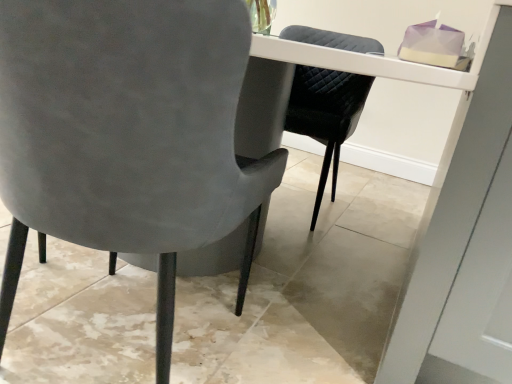
The width and height of the screenshot is (512, 384). What do you see at coordinates (126, 134) in the screenshot?
I see `velvet gray chair at center` at bounding box center [126, 134].

The width and height of the screenshot is (512, 384). Identify the location of velvet gray chair at center. (126, 134).

Locate an element on the screen. velvet gray chair at center is located at coordinates (126, 134).